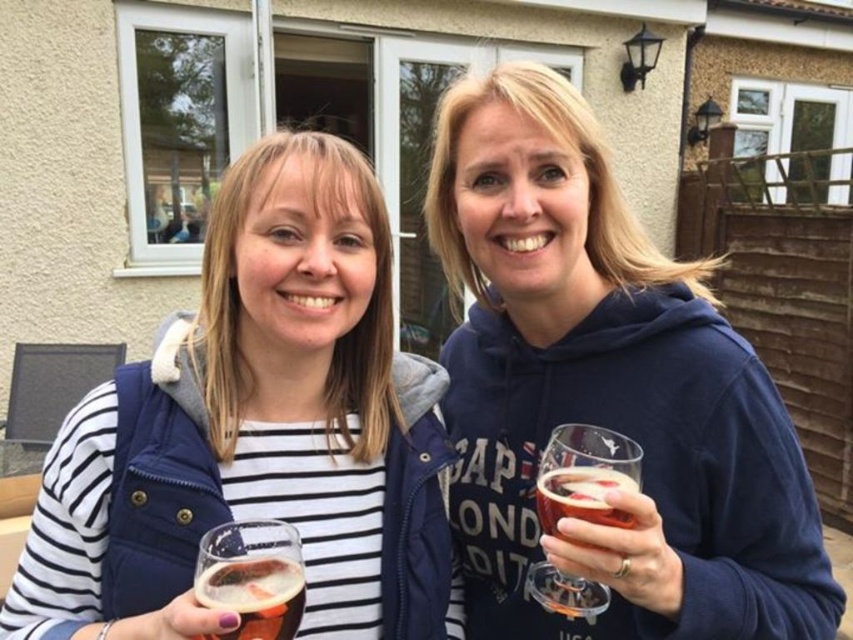
You are a photographer standing 1 meter away from the blue cotton hoodie at center. You want to take a photo of it without including the residential building in the background. Can you step back enough to achieve this?

The blue cotton hoodie at center is 72.40 centimeters away from the camera. Since you are already 1 meter away, stepping back would increase the distance, but the residential building is part of the background behind the hoodie. To exclude the building, you need to move closer to the hoodie, not step back. However, moving closer than 72.40 cm might not be possible as the distance given is from the camera. Therefore, it might not be feasible to exclude the building without adjusting the camera angle or using

You are a delivery person who needs to place a small package between the blue cotton hoodie at center and the translucent glass at right. Can you fit the package between them if the package is 10 cm wide?

The blue cotton hoodie at center is wider than the translucent glass at right. Since the package is 10 cm wide, it can fit between them as long as the space between the two objects is at least 10 cm. However, the exact width difference isn

You are a bartender trying to place two beer glasses on a narrow shelf that can only hold items up to 12 cm in width. You have the translucent glass at right and the translucent glass beer at center. Based on their sizes, which one is more likely to fit on the shelf?

The translucent glass beer at center is more likely to fit on the shelf since its width is smaller than the translucent glass at right, which exceeds the 12 cm limit.